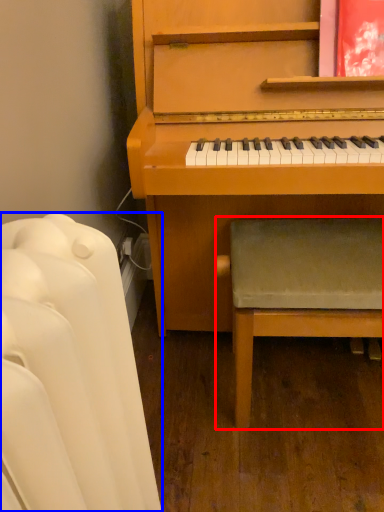
Question: Among these objects, which one is farthest to the camera, armchair (highlighted by a red box) or furniture (highlighted by a blue box)?

Choices:
 (A) armchair
 (B) furniture

Answer: (A)